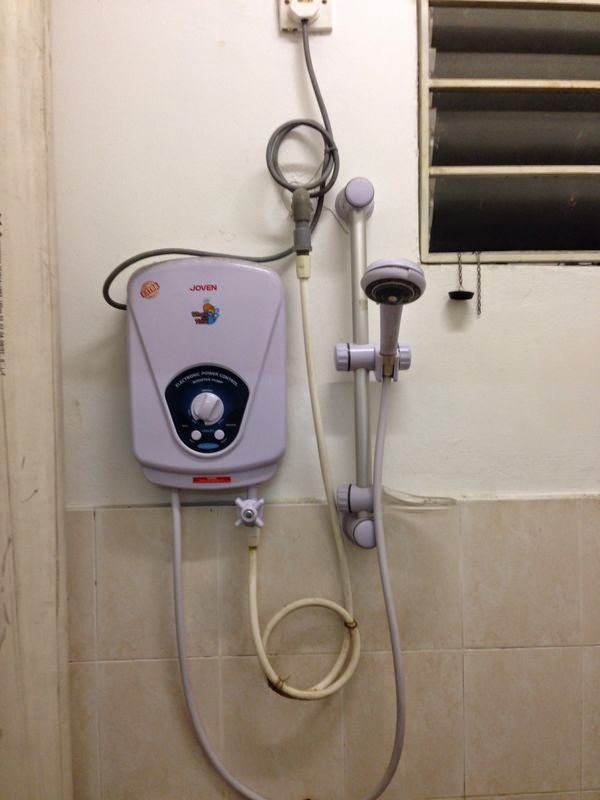
The image size is (600, 800). Find the location of `wooden post connected to wall`. wooden post connected to wall is located at coordinates (31, 494).